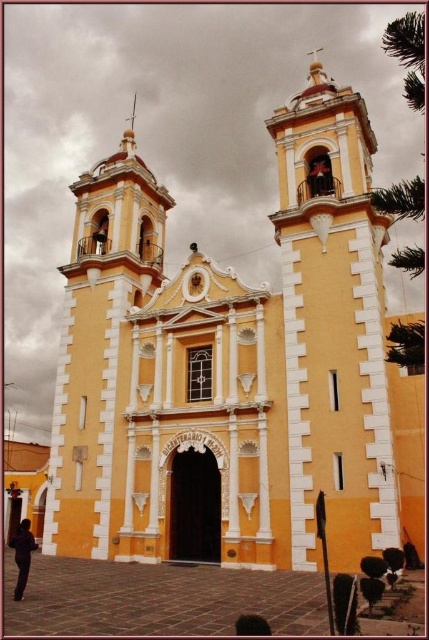
Question: Can you confirm if yellow matte church at center is wider than dark brown leather jacket at lower left?

Choices:
 (A) no
 (B) yes

Answer: (B)

Question: Which point is farther to the camera?

Choices:
 (A) (9, 545)
 (B) (335, 556)
 (C) (329, 474)

Answer: (A)

Question: Is yellow matte church at center smaller than smooth orange bell tower at right?

Choices:
 (A) no
 (B) yes

Answer: (A)

Question: Estimate the real-world distances between objects in this image. Which object is farther from the smooth orange bell tower at right?

Choices:
 (A) dark brown leather jacket at lower left
 (B) yellow matte church at center

Answer: (A)

Question: Which object is closer to the camera taking this photo?

Choices:
 (A) yellow matte church at center
 (B) dark brown leather jacket at lower left

Answer: (B)

Question: Does smooth orange bell tower at right appear on the right side of dark brown leather jacket at lower left?

Choices:
 (A) no
 (B) yes

Answer: (B)